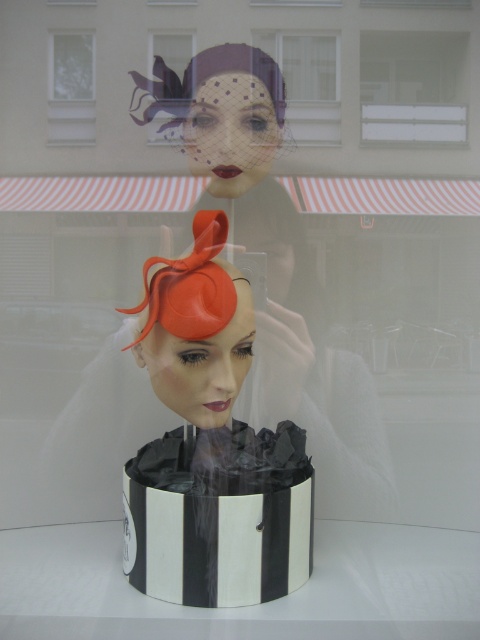
Question: Is orange matte fascinator at center wider than white matte window at upper center?

Choices:
 (A) yes
 (B) no

Answer: (A)

Question: Among these objects, which one is farthest from the camera?

Choices:
 (A) white matte window at upper center
 (B) transparent glass window at upper left
 (C) orange matte fascinator at center

Answer: (A)

Question: Which object is the farthest from the matte black hat at center?

Choices:
 (A) orange matte fascinator at center
 (B) transparent glass window at upper left
 (C) white matte window at upper center

Answer: (A)

Question: Which is nearer to the transparent glass window at upper left?

Choices:
 (A) matte black hat at upper center
 (B) orange matte fascinator at center
 (C) white matte window at upper center

Answer: (A)

Question: Can you confirm if white matte window at upper center is smaller than matte black hat at upper center?

Choices:
 (A) yes
 (B) no

Answer: (B)

Question: Is white matte window at upper center above transparent glass window at upper left?

Choices:
 (A) yes
 (B) no

Answer: (B)